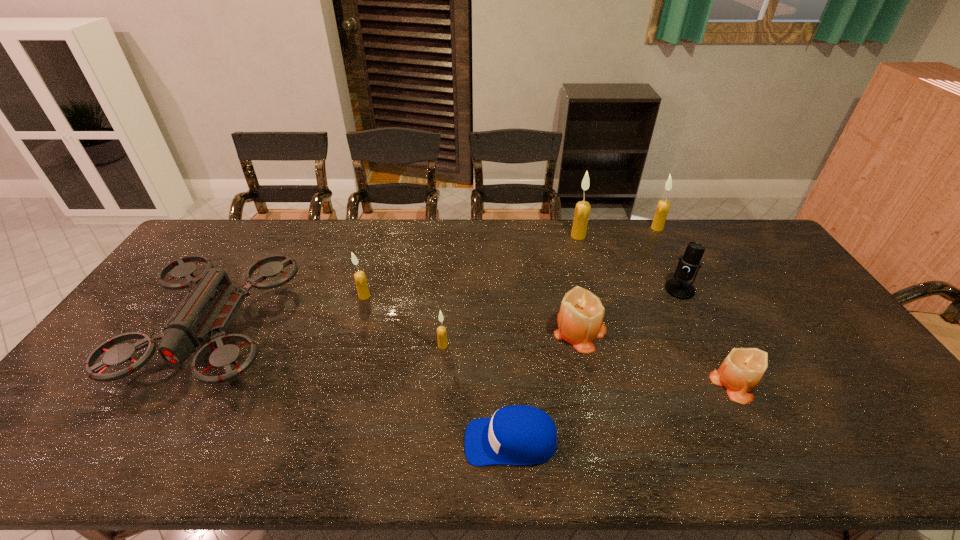
Where is `vacant region located on the right of the microphone`? Image resolution: width=960 pixels, height=540 pixels. vacant region located on the right of the microphone is located at coordinates (763, 289).

This screenshot has width=960, height=540. Identify the location of vacant area situated 0.240m on the right of the left beige candle. (690, 330).

At what (x,y) coordinates should I click in order to perform the action: click on free region located 0.140m on the front-facing side of the gray drone. Please return your answer as a coordinate pair (x, y). The height and width of the screenshot is (540, 960). Looking at the image, I should click on (137, 457).

Where is `blank space located on the left of the second candle from left to right`? Image resolution: width=960 pixels, height=540 pixels. blank space located on the left of the second candle from left to right is located at coordinates (359, 346).

This screenshot has height=540, width=960. In order to click on free space located on the left of the nearer beige candle in this screenshot , I will do `click(668, 383)`.

The height and width of the screenshot is (540, 960). I want to click on vacant space located on the front-facing side of the shortest object, so click(439, 441).

Locate an element on the screen. The image size is (960, 540). free location located 0.050m on the front-facing side of the shortest object is located at coordinates (444, 441).

Identify the location of free point located 0.370m on the front-facing side of the shortest object. (304, 441).

Where is `object present at the near edge`? This screenshot has height=540, width=960. object present at the near edge is located at coordinates (515, 435).

Locate an element on the screen. The image size is (960, 540). object located at the left edge is located at coordinates (207, 310).